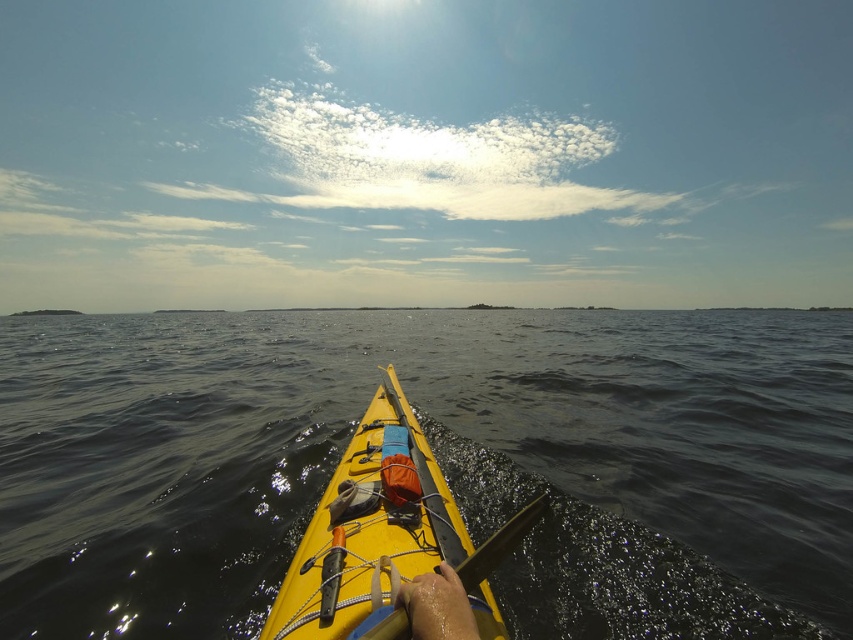
You are in a kayak and need to navigate to a specific location marked by point coordinates. The coordinates given are point (436, 460). Based on the scene description, where is this point located?

The point (436, 460) is located at the dark blue water at center.

You are navigating a kayak and need to determine your position relative to the center of the image. Given that the yellow matte kayak at center is located at coordinates 0.830 on the x and 0.431 on the y axis, is your kayak closer to the right edge or the left edge of the image?

The yellow matte kayak at center is located at coordinates 0.830 on the x and 0.431 on the y axis. Since the x coordinate is closer to 1.0 than 0.0, the kayak is closer to the right edge of the image.